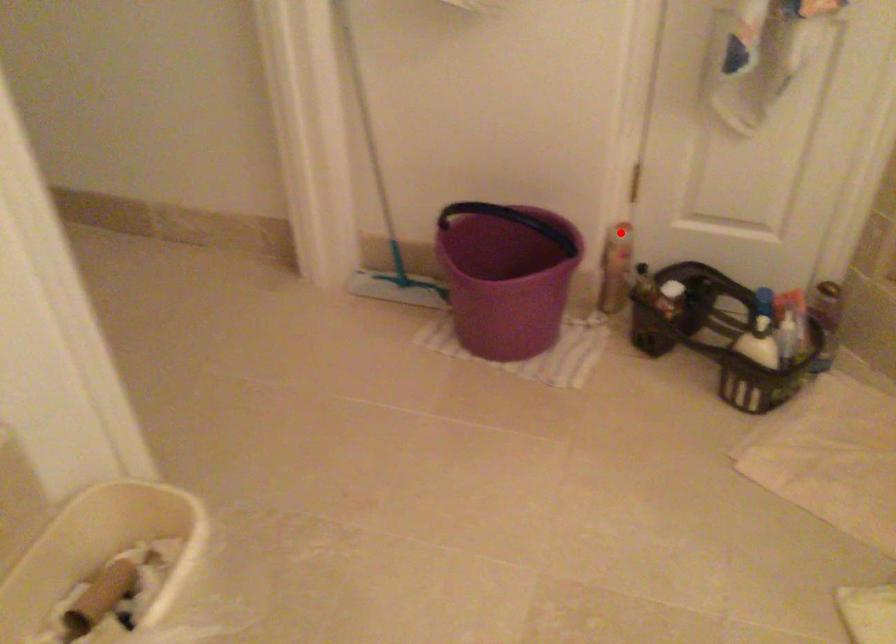
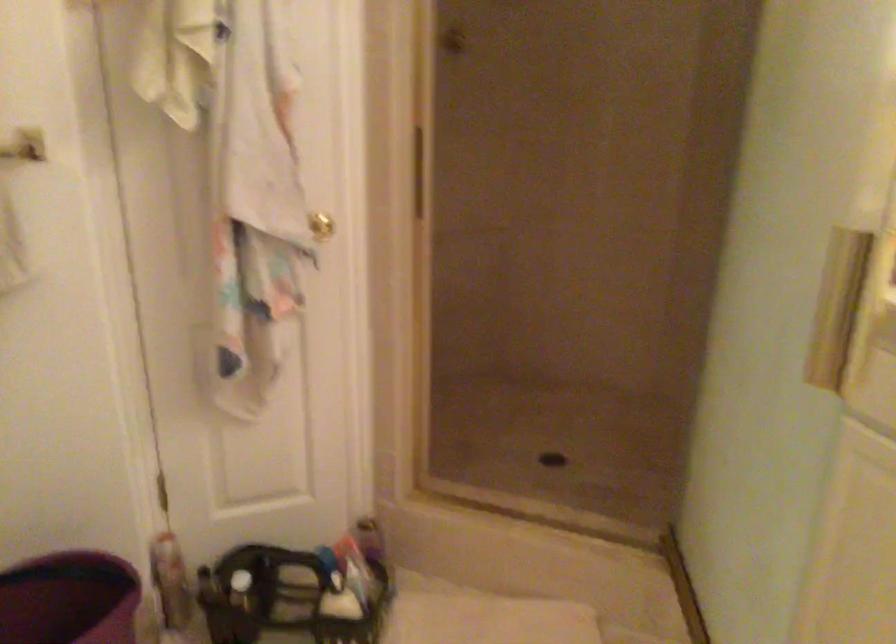
Find the pixel in the second image that matches the highlighted location in the first image.

(165, 545)